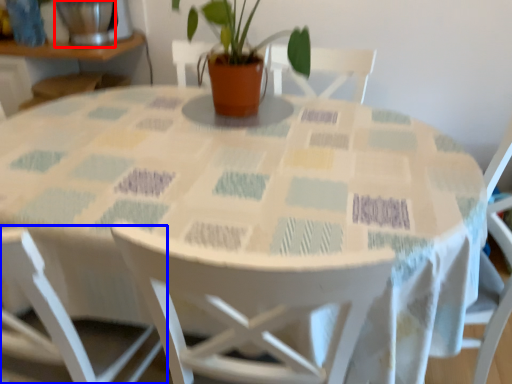
Question: Which point is further to the camera, glass vase (highlighted by a red box) or chair (highlighted by a blue box)?

Choices:
 (A) glass vase
 (B) chair

Answer: (A)